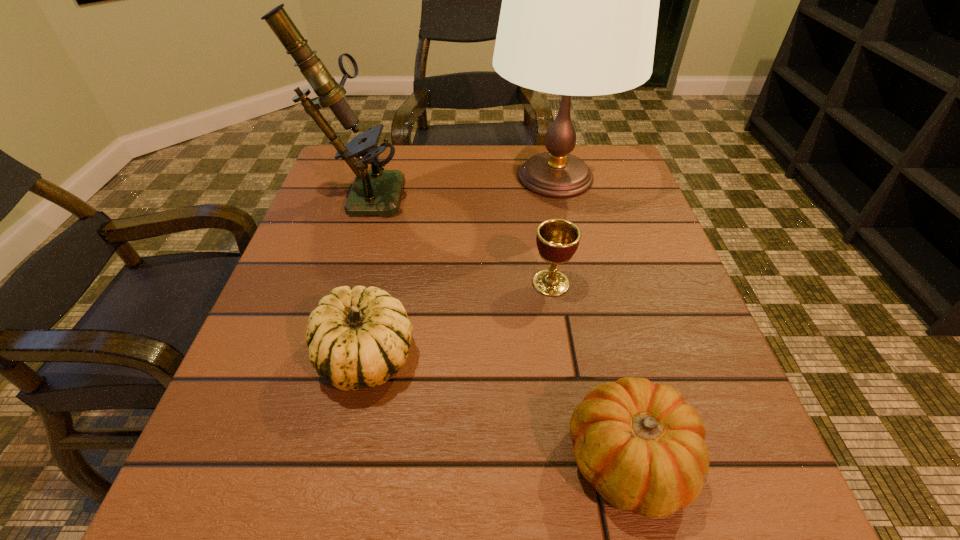
Find the location of a particular element. the tallest object is located at coordinates (580, 0).

I want to click on the fourth shortest object, so click(x=374, y=192).

This screenshot has width=960, height=540. Find the location of `the left gourd`. the left gourd is located at coordinates (358, 337).

This screenshot has height=540, width=960. Find the location of `the third farthest object`. the third farthest object is located at coordinates (557, 240).

Find the location of a particular element. The image size is (960, 540). the shorter gourd is located at coordinates (640, 444).

Where is `the shortest object`? This screenshot has width=960, height=540. the shortest object is located at coordinates (640, 444).

Image resolution: width=960 pixels, height=540 pixels. I want to click on vacant space situated 0.050m on the front of the tallest object, so click(x=567, y=231).

I want to click on vacant area situated 0.100m at the eyepiece of the microscope, so click(445, 192).

Find the location of `free space located on the back of the taller gourd`. free space located on the back of the taller gourd is located at coordinates (384, 274).

The height and width of the screenshot is (540, 960). Identify the location of vacant space located 0.220m on the back of the third farthest object. (539, 202).